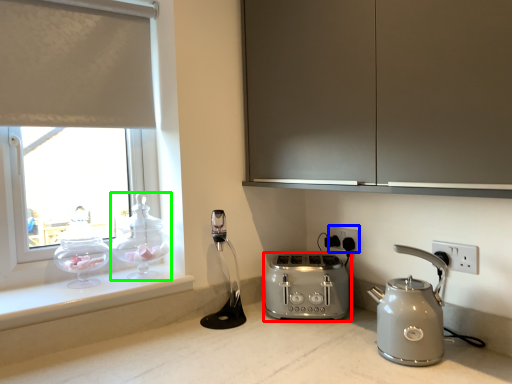
Question: Estimate the real-world distances between objects in this image. Which object is closer to toaster (highlighted by a red box), electric outlet (highlighted by a blue box) or tea pot (highlighted by a green box)?

Choices:
 (A) electric outlet
 (B) tea pot

Answer: (A)